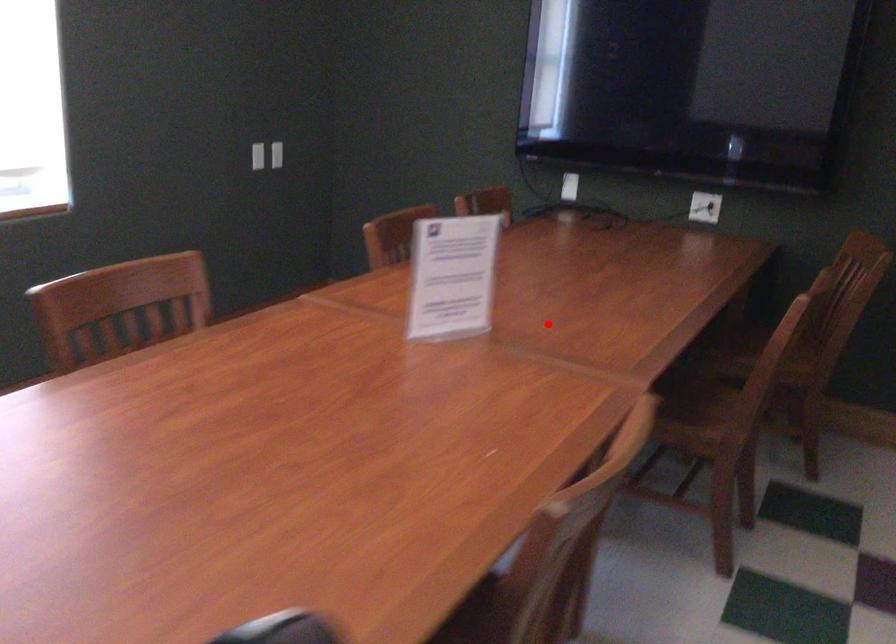
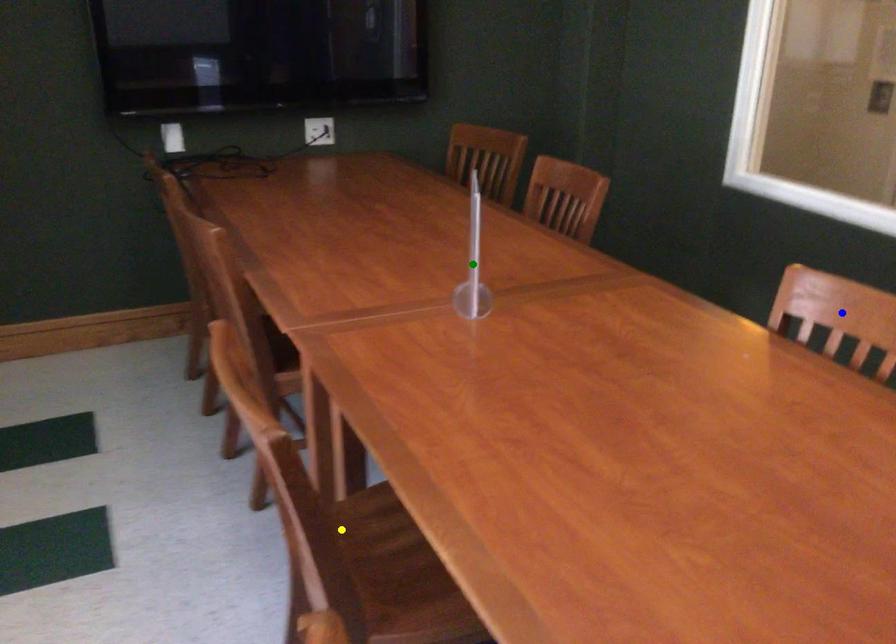
Question: I am providing you with two images of the same scene from different viewpoints. A red point is marked on the first image. You are given multiple points on the second image. Which spot in image 2 lines up with the point in image 1?

Choices:
 (A) green point
 (B) blue point
 (C) yellow point

Answer: (A)